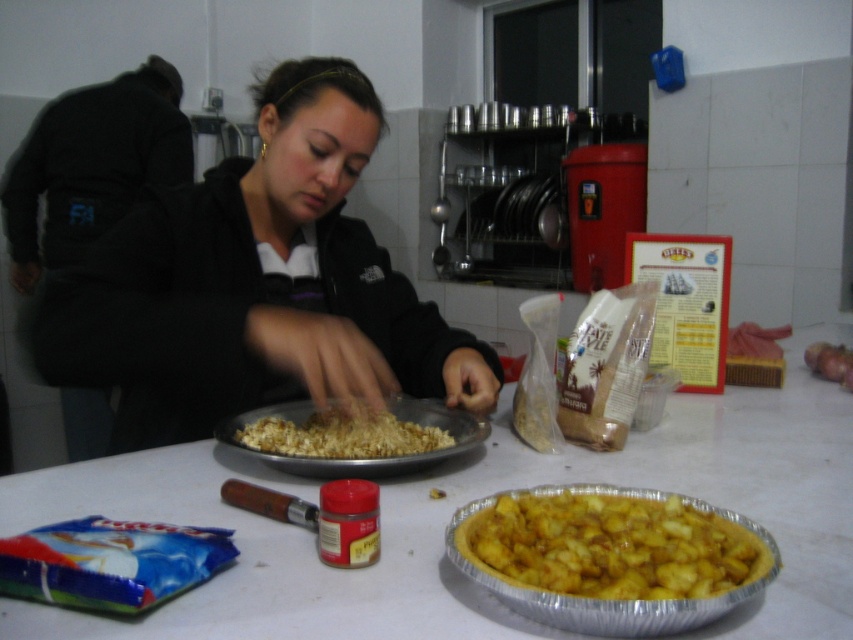
Question: Which of the following is the farthest from the observer?

Choices:
 (A) black matte jacket at center
 (B) golden crumbly pie at center

Answer: (A)

Question: In this image, where is white matte table at center located relative to black matte jacket at center?

Choices:
 (A) above
 (B) below

Answer: (B)

Question: Which object is closer to the camera taking this photo?

Choices:
 (A) golden crunchy popcorn at center
 (B) white matte table at center

Answer: (B)

Question: Is white matte table at center to the left of black matte jacket at center from the viewer's perspective?

Choices:
 (A) no
 (B) yes

Answer: (A)

Question: Which point is farther to the camera?

Choices:
 (A) white matte table at center
 (B) golden crumbly pie at center

Answer: (A)

Question: Is white matte table at center positioned in front of golden crumbly pie at center?

Choices:
 (A) yes
 (B) no

Answer: (B)